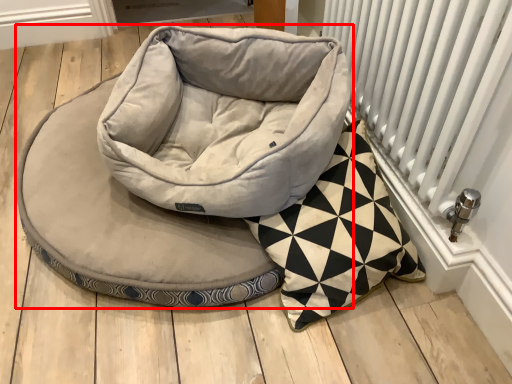
Question: Where is dog bed (annotated by the red box) located in relation to radiator in the image?

Choices:
 (A) left
 (B) right

Answer: (A)